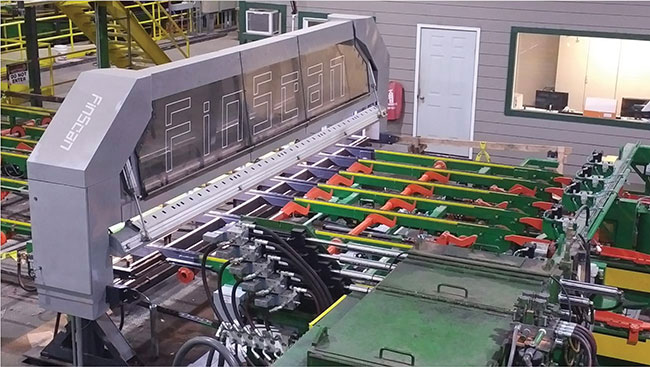
Locate an element on the screen. door is located at coordinates (452, 75).